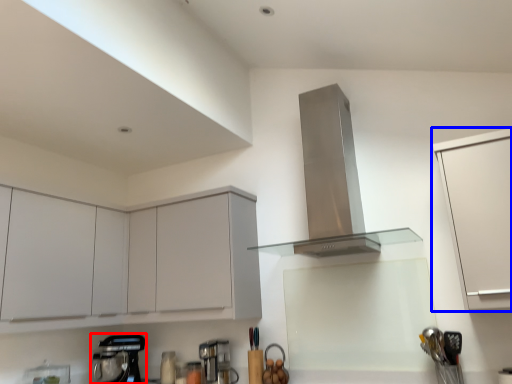
Question: Among these objects, which one is farthest to the camera, kitchen appliance (highlighted by a red box) or cabinetry (highlighted by a blue box)?

Choices:
 (A) kitchen appliance
 (B) cabinetry

Answer: (A)